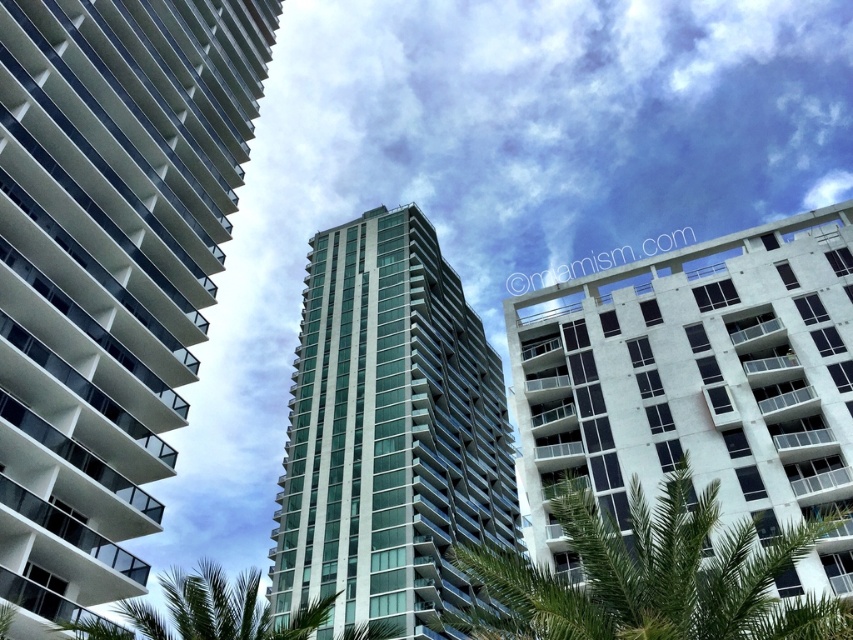
Between white glass building at left and green leafy palm tree at center, which one appears on the right side from the viewer's perspective?

green leafy palm tree at center

Is point (134, 164) in front of point (668, 593)?

No.

Is point (108, 294) positioned before point (491, 588)?

No, (108, 294) is behind (491, 588).

Find the location of a particular element. Image resolution: width=853 pixels, height=640 pixels. white glass building at left is located at coordinates (107, 269).

Which is above, white glass building at left or green leafy palm tree at lower center?

Positioned higher is white glass building at left.

Does white glass building at left lie behind green leafy palm tree at lower center?

Yes.

Is point (45, 369) positioned behind point (112, 627)?

Yes, point (45, 369) is behind point (112, 627).

At what (x,y) coordinates should I click in order to perform the action: click on white glass building at left. Please return your answer as a coordinate pair (x, y). The image size is (853, 640). Looking at the image, I should click on (107, 269).

Who is positioned more to the left, white concrete building at right or green glass building at center?

green glass building at center

Consider the image. How much distance is there between white concrete building at right and green glass building at center?

27.44 meters

Describe the element at coordinates (698, 385) in the screenshot. The height and width of the screenshot is (640, 853). I see `white concrete building at right` at that location.

Locate an element on the screen. This screenshot has height=640, width=853. white concrete building at right is located at coordinates (698, 385).